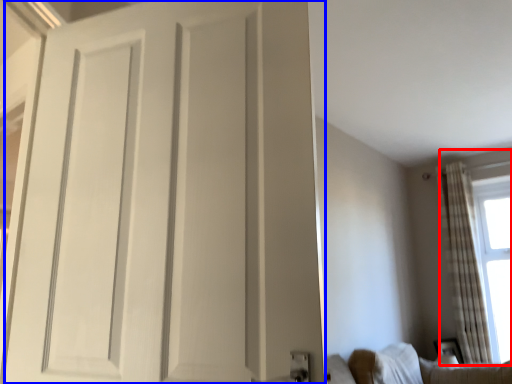
Question: Which of the following is the farthest to the observer, window (highlighted by a red box) or door (highlighted by a blue box)?

Choices:
 (A) window
 (B) door

Answer: (A)